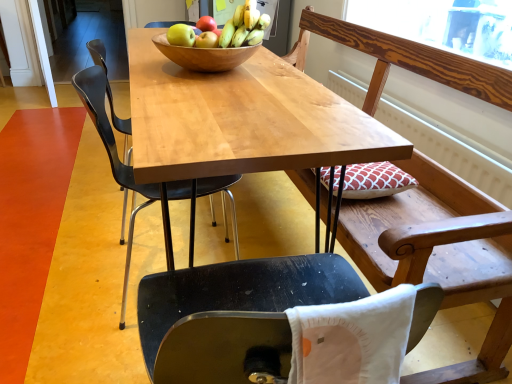
Question: Is white fabric pillow at lower center completely or partially inside wooden bench at upper right?

Choices:
 (A) no
 (B) yes

Answer: (A)

Question: Is wooden bench at upper right in contact with white fabric pillow at lower center?

Choices:
 (A) yes
 (B) no

Answer: (B)

Question: Does wooden bench at upper right have a lesser height compared to white fabric pillow at lower center?

Choices:
 (A) yes
 (B) no

Answer: (B)

Question: Can you confirm if wooden bench at upper right is thinner than white fabric pillow at lower center?

Choices:
 (A) no
 (B) yes

Answer: (A)

Question: Can you confirm if wooden bench at upper right is positioned to the right of white fabric pillow at lower center?

Choices:
 (A) yes
 (B) no

Answer: (A)

Question: From a real-world perspective, is wooden bench at upper right under white fabric pillow at lower center?

Choices:
 (A) yes
 (B) no

Answer: (A)

Question: Are matte green apple at center, the 2th apple in the back-to-front sequence, and wooden bowl at center located far from each other?

Choices:
 (A) no
 (B) yes

Answer: (A)

Question: Is matte green apple at center, which appears as the 2th apple when viewed from the front, next to wooden bowl at center and touching it?

Choices:
 (A) yes
 (B) no

Answer: (A)

Question: Is matte green apple at center, which appears as the 2th apple when viewed from the front, further to camera compared to wooden bowl at center?

Choices:
 (A) no
 (B) yes

Answer: (B)

Question: From a real-world perspective, is matte green apple at center, which appears as the 2th apple when viewed from the front, positioned under wooden bowl at center based on gravity?

Choices:
 (A) no
 (B) yes

Answer: (A)

Question: Is matte green apple at center, the 2th apple in the back-to-front sequence, smaller than wooden bowl at center?

Choices:
 (A) yes
 (B) no

Answer: (A)

Question: Is matte green apple at center, the 2th apple in the back-to-front sequence, completely or partially outside of wooden bowl at center?

Choices:
 (A) no
 (B) yes

Answer: (A)

Question: Is wooden bowl at center facing away from matte yellow apple at center, the 1th apple viewed from the front?

Choices:
 (A) no
 (B) yes

Answer: (A)